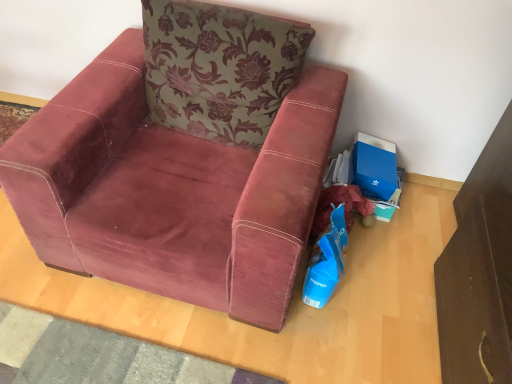
Question: In terms of size, does blue cardboard box at lower right appear bigger or smaller than green floral fabric pillow at upper center?

Choices:
 (A) big
 (B) small

Answer: (B)

Question: Considering their positions, is blue cardboard box at lower right located in front of or behind green floral fabric pillow at upper center?

Choices:
 (A) front
 (B) behind

Answer: (B)

Question: Estimate the real-world distances between objects in this image. Which object is farther from the blue plastic shopping bag at lower right?

Choices:
 (A) green floral fabric pillow at upper center
 (B) blue cardboard box at lower right
 (C) velvet maroon armchair at center

Answer: (A)

Question: Which object is positioned closest to the blue cardboard box at lower right?

Choices:
 (A) velvet maroon armchair at center
 (B) blue plastic shopping bag at lower right
 (C) green floral fabric pillow at upper center

Answer: (B)